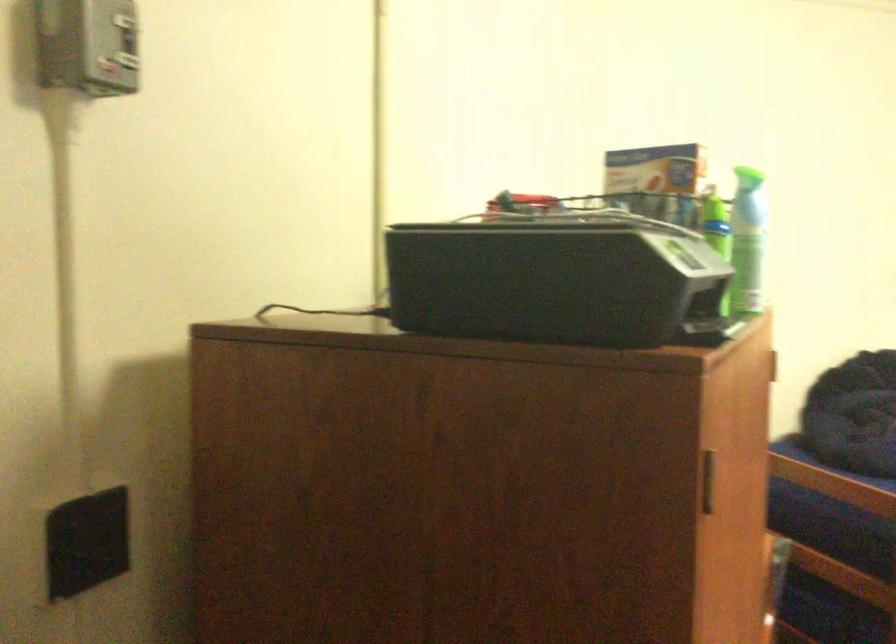
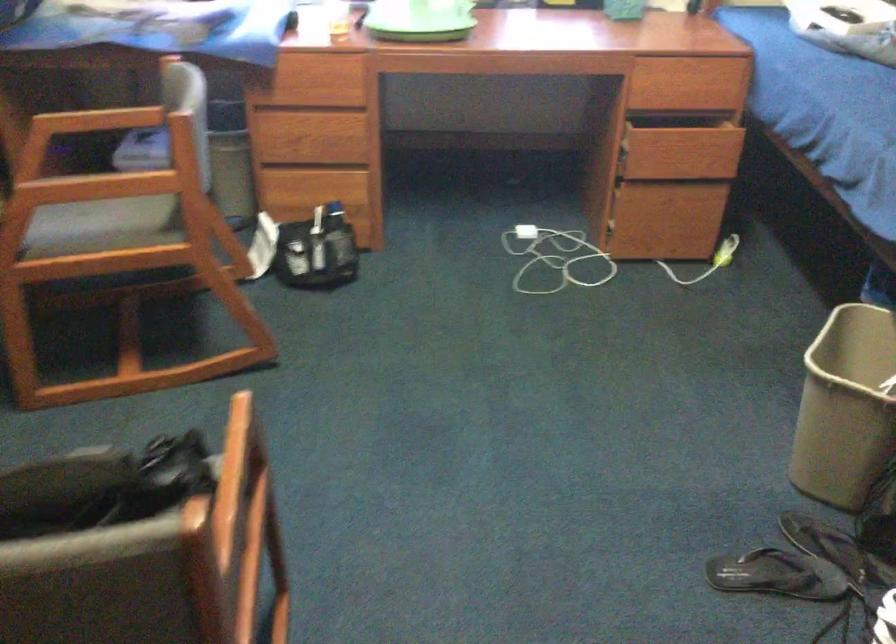
First-person continuous shooting, in which direction is the camera rotating?

The camera rotated toward right-down.